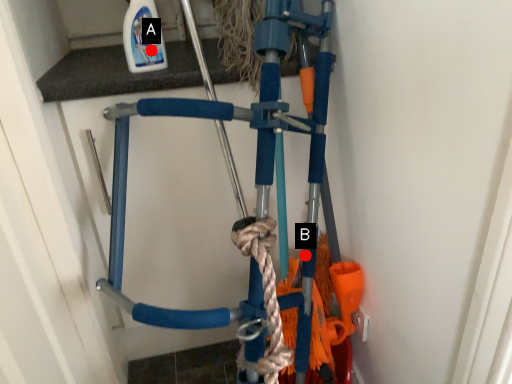
Question: Two points are circled on the image, labeled by A and B beside each circle. Which point is closer to the camera?

Choices:
 (A) A is closer
 (B) B is closer

Answer: (A)